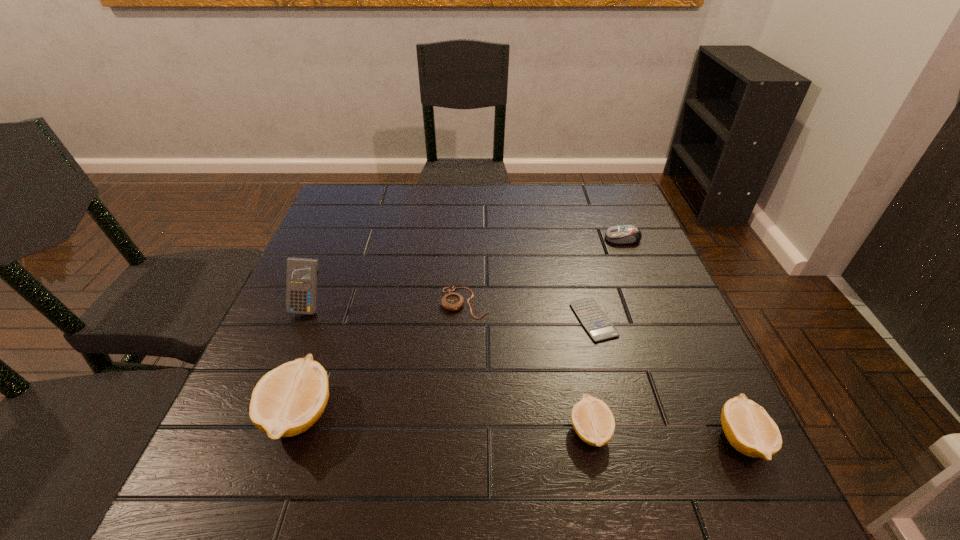
Please point a spot to place another lemon for symmetrical spacing. Please provide its 2D coordinates. Your answer should be formatted as a tuple, i.e. [(x, y)], where the tuple contains the x and y coordinates of a point satisfying the conditions above.

[(443, 422)]